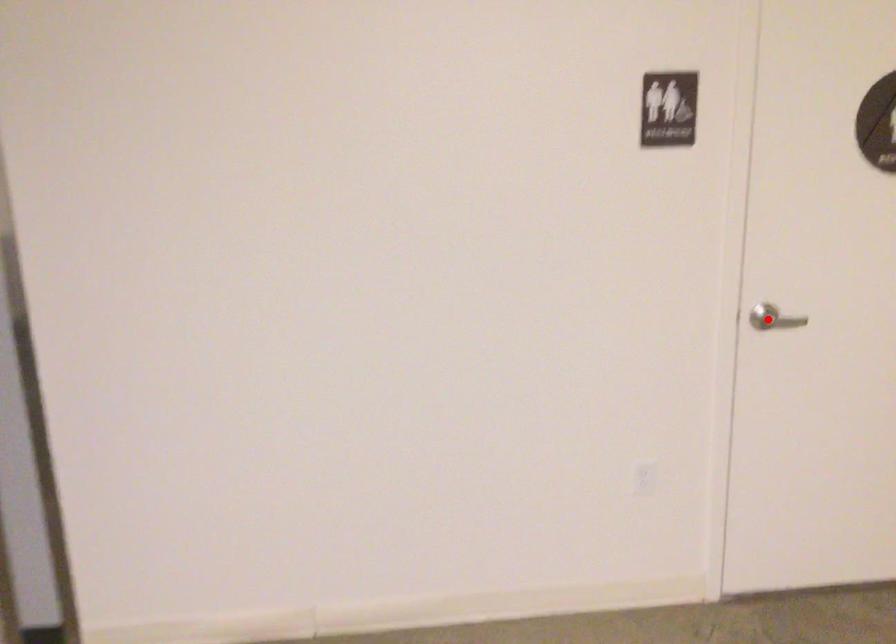
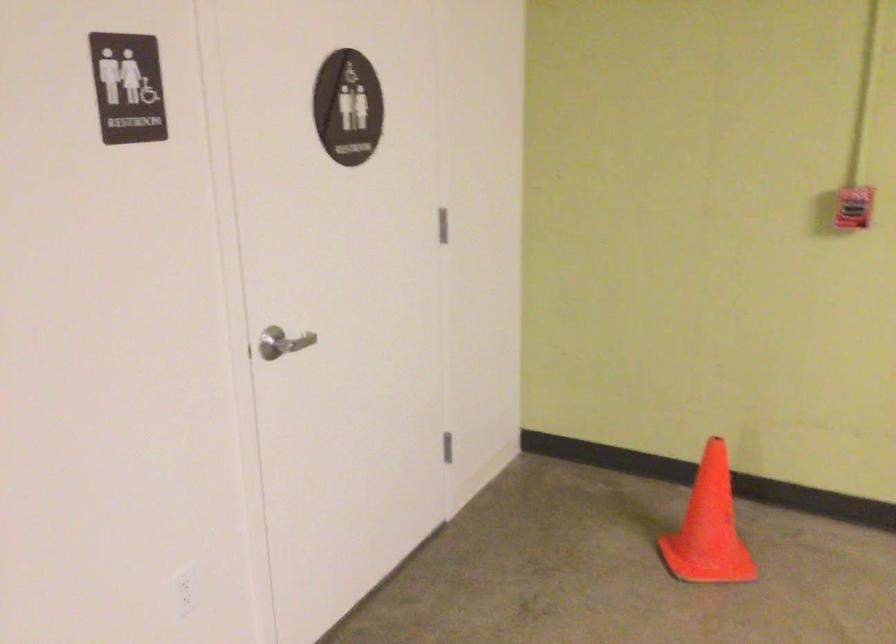
Question: A red point is marked in image1. In image2, is the corresponding 3D point closer to the camera or farther? Reply with the corresponding letter.

Choices:
 (A) The corresponding 3D point is closer.
 (B) The corresponding 3D point is farther.

Answer: (A)